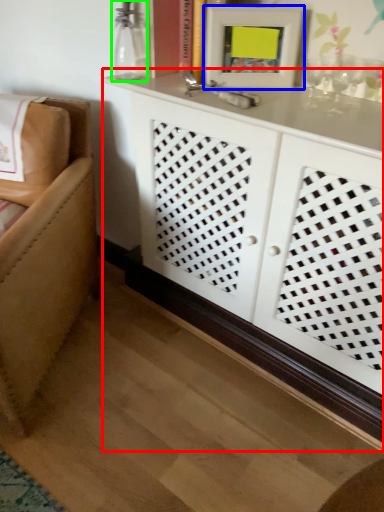
Question: Which is nearer to the cabinetry (highlighted by a red box)? picture frame (highlighted by a blue box) or glass vase (highlighted by a green box).

Choices:
 (A) picture frame
 (B) glass vase

Answer: (A)